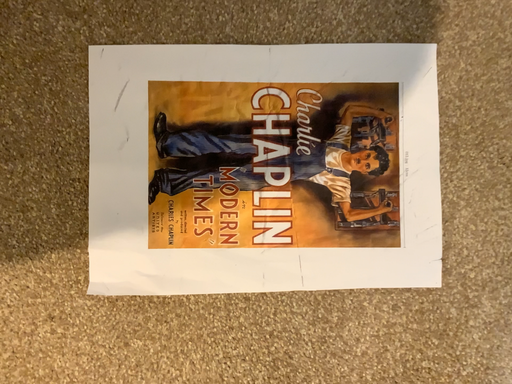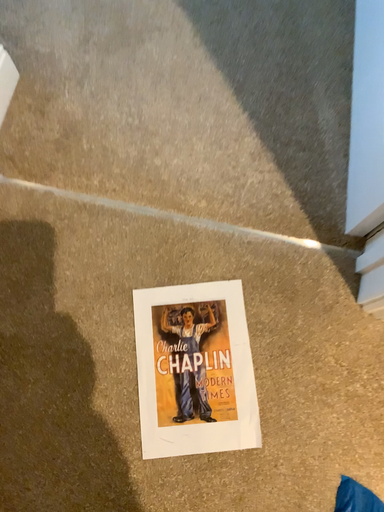
Question: Which way did the camera rotate in the video?

Choices:
 (A) rotated downward
 (B) rotated upward

Answer: (B)